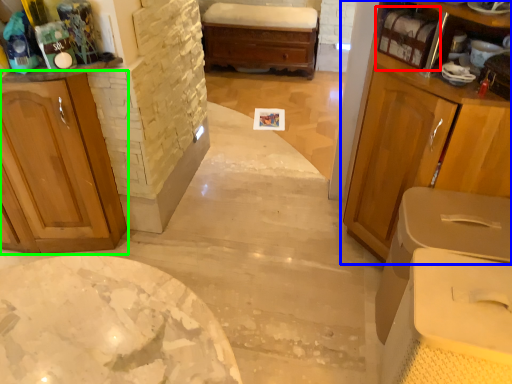
Question: Estimate the real-world distances between objects in this image. Which object is farther from shelf (highlighted by a red box), cabinetry (highlighted by a blue box) or cabinetry (highlighted by a green box)?

Choices:
 (A) cabinetry
 (B) cabinetry

Answer: (B)